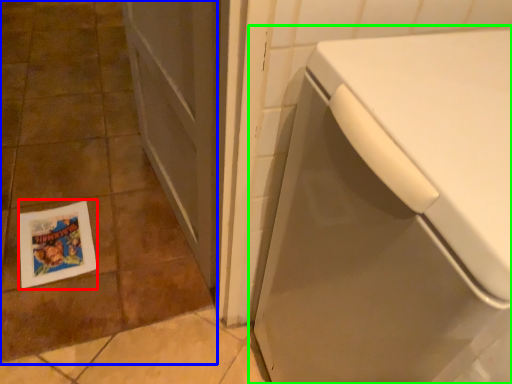
Question: Which object is the farthest from flyer (highlighted by a red box)? Choose among these: ceramic tile (highlighted by a blue box) or washing machine (highlighted by a green box).

Choices:
 (A) ceramic tile
 (B) washing machine

Answer: (B)